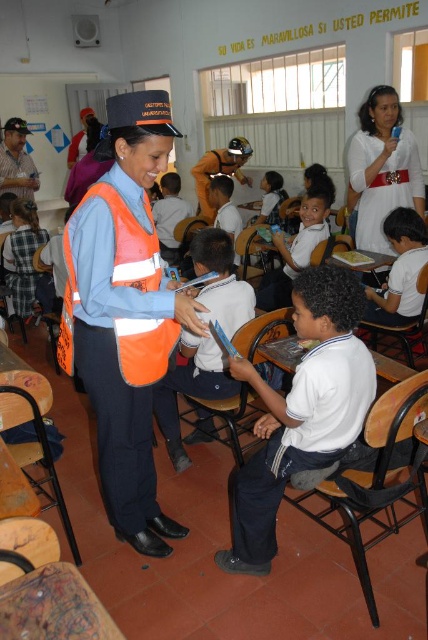
Question: Does orange reflective safety vest at center have a lesser width compared to white matte shirt at lower right?

Choices:
 (A) no
 (B) yes

Answer: (A)

Question: Among these points, which one is farthest from the camera?

Choices:
 (A) (92, 202)
 (B) (326, 237)
 (C) (8, 253)

Answer: (C)

Question: Is white smooth shirt at center to the right of orange reflective vest at left from the viewer's perspective?

Choices:
 (A) yes
 (B) no

Answer: (A)

Question: Observing the image, what is the correct spatial positioning of white smooth shirt at center in reference to white uniform shirt at center?

Choices:
 (A) above
 (B) below

Answer: (B)

Question: Which of the following is the farthest from the observer?

Choices:
 (A) (240, 474)
 (B) (101, 250)
 (C) (139, 269)

Answer: (A)

Question: Which is farther from the white glossy shirt at center?

Choices:
 (A) white satin dress at upper center
 (B) orange reflective vest at center
 (C) white uniform shirt at center
 (D) white matte shirt at lower right

Answer: (C)